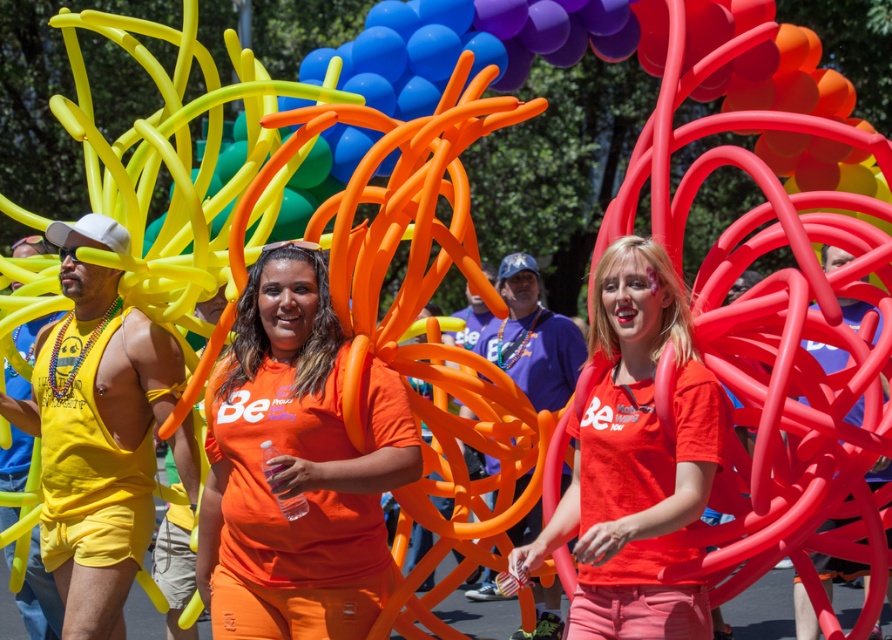
Who is positioned more to the right, matte orange shirt at center or matte yellow tank top at left?

matte orange shirt at center is more to the right.

Where is `matte orange shirt at center`? matte orange shirt at center is located at coordinates (636, 458).

The height and width of the screenshot is (640, 892). What do you see at coordinates (636, 458) in the screenshot?
I see `matte orange shirt at center` at bounding box center [636, 458].

The width and height of the screenshot is (892, 640). Identify the location of matte orange shirt at center. (636, 458).

Based on the photo, who is positioned more to the left, orange matte shirt at center or matte orange shirt at center?

Positioned to the left is orange matte shirt at center.

You are a GUI agent. You are given a task and a screenshot of the screen. Output one action in this format:
    pyautogui.click(x=<x>, y=<y>)
    Task: Click on the orange matte shirt at center
    This screenshot has height=640, width=892.
    Given the screenshot: What is the action you would take?
    pyautogui.click(x=296, y=467)

Can you confirm if orange matte shirt at center is positioned below rubber balloon at center?

Indeed, orange matte shirt at center is positioned under rubber balloon at center.

In order to click on orange matte shirt at center in this screenshot , I will do pos(296,467).

The height and width of the screenshot is (640, 892). I want to click on orange matte shirt at center, so click(x=296, y=467).